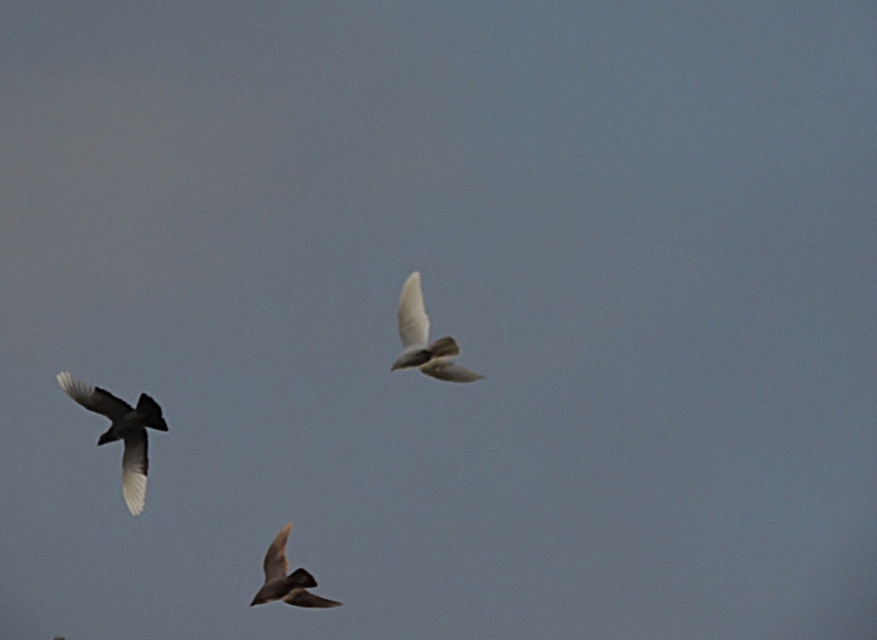
You are a birdwatcher observing three pigeons in flight. You notice two specific points in the image labeled as point 1 at coordinates point 1 at point (134, 454) and point 2 at point (305, 595). Based on their positions, which point is closer to you, the observer?

Point 1 at point (134, 454) is closer to you because it is further to the viewer than point 2 at point (305, 595).

You are a birdwatcher observing the birds in the image. You notice two birds, the dark brown feathered bird at left and the white feathered bird at center. Which bird is positioned to the left of the other?

The dark brown feathered bird at left is positioned to the left of the white feathered bird at center.